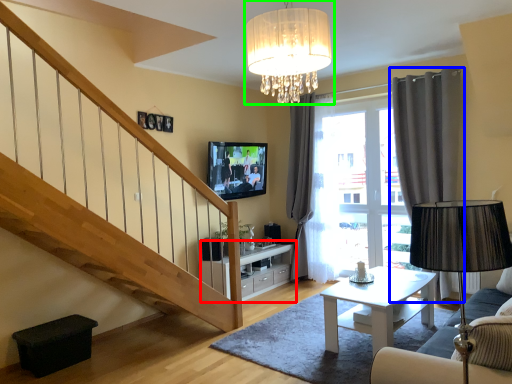
Question: Which object is the closest to the cabinetry (highlighted by a red box)? Choose among these: curtain (highlighted by a blue box) or lamp (highlighted by a green box).

Choices:
 (A) curtain
 (B) lamp

Answer: (A)